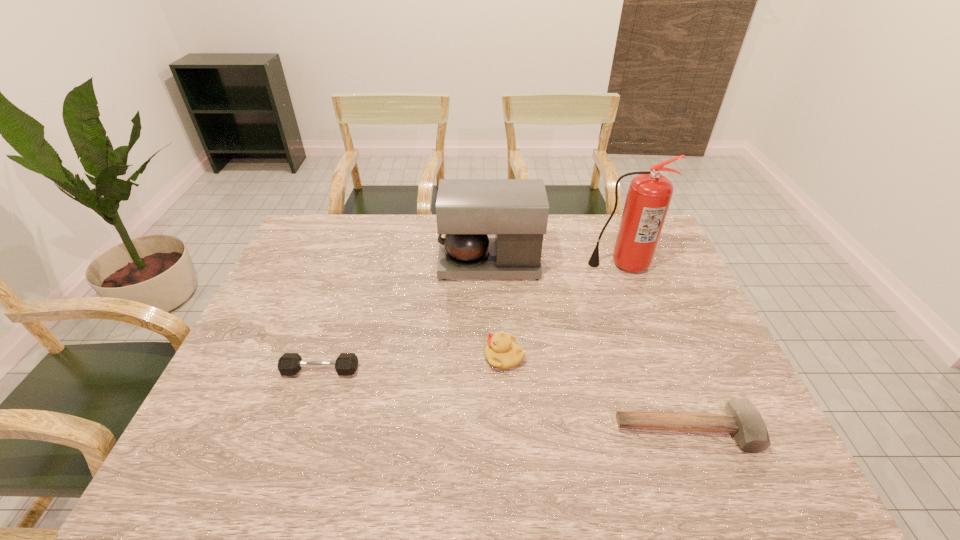
This screenshot has height=540, width=960. In order to click on the tallest object in this screenshot , I will do `click(649, 195)`.

Where is `the fourth shortest object`? The width and height of the screenshot is (960, 540). the fourth shortest object is located at coordinates (516, 210).

Locate an element on the screen. the third shortest object is located at coordinates (502, 352).

In order to click on dumbbell in this screenshot , I will do `click(289, 364)`.

I want to click on the nearest object, so click(x=742, y=419).

Image resolution: width=960 pixels, height=540 pixels. In order to click on blank space located 0.380m on the instruction side of the fire extinguisher in this screenshot , I will do `click(664, 376)`.

At what (x,y) coordinates should I click in order to perform the action: click on vacant area situated on the carafe side of the second tallest object. Please return your answer as a coordinate pair (x, y). This screenshot has height=540, width=960. Looking at the image, I should click on (348, 264).

Locate an element on the screen. The width and height of the screenshot is (960, 540). vacant space located 0.250m on the carafe side of the second tallest object is located at coordinates (361, 264).

This screenshot has height=540, width=960. I want to click on blank space located 0.280m on the carafe side of the second tallest object, so click(352, 264).

Find the location of a particular element. This screenshot has width=960, height=540. blank area located 0.060m on the front-facing side of the third shortest object is located at coordinates (461, 357).